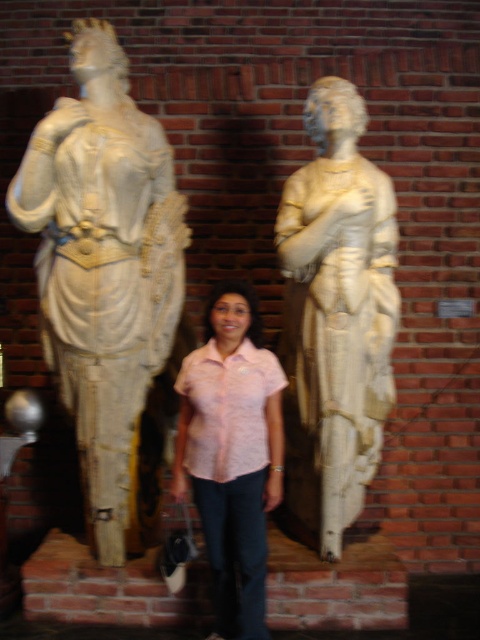
Question: Observing the image, what is the correct spatial positioning of pink floral shirt at center in reference to pink textured shirt at center?

Choices:
 (A) above
 (B) below

Answer: (B)

Question: Which point appears farthest from the camera in this image?

Choices:
 (A) (290, 488)
 (B) (214, 595)
 (C) (72, 410)

Answer: (A)

Question: Considering the real-world distances, which object is farthest from the pink floral shirt at center?

Choices:
 (A) white marble statue at right
 (B) pink textured shirt at center
 (C) white marble statue at left

Answer: (C)

Question: Is white marble statue at left positioned behind white marble statue at right?

Choices:
 (A) no
 (B) yes

Answer: (A)

Question: Which point is farther from the camera taking this photo?

Choices:
 (A) click(x=196, y=353)
 (B) click(x=39, y=195)
 (C) click(x=235, y=518)
 (D) click(x=294, y=264)

Answer: (D)

Question: Is white marble statue at left further to camera compared to white marble statue at right?

Choices:
 (A) yes
 (B) no

Answer: (B)